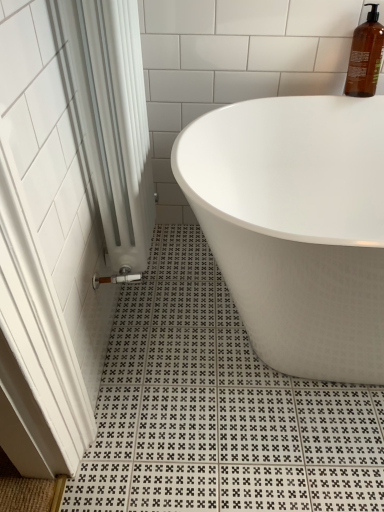
Question: From a real-world perspective, is white glossy bathtub at center under white fabric shower curtain at left?

Choices:
 (A) yes
 (B) no

Answer: (A)

Question: Considering the relative sizes of white glossy bathtub at center and white fabric shower curtain at left in the image provided, is white glossy bathtub at center smaller than white fabric shower curtain at left?

Choices:
 (A) no
 (B) yes

Answer: (A)

Question: Considering the relative sizes of white glossy bathtub at center and white fabric shower curtain at left in the image provided, is white glossy bathtub at center taller than white fabric shower curtain at left?

Choices:
 (A) no
 (B) yes

Answer: (A)

Question: Does white glossy bathtub at center turn towards white fabric shower curtain at left?

Choices:
 (A) no
 (B) yes

Answer: (A)

Question: Is white glossy bathtub at center closer to the viewer compared to white fabric shower curtain at left?

Choices:
 (A) no
 (B) yes

Answer: (A)

Question: Is translucent amber bottle at upper right situated inside white glossy bathtub at center or outside?

Choices:
 (A) outside
 (B) inside

Answer: (A)

Question: Considering the positions of point (369, 52) and point (241, 138), is point (369, 52) closer or farther from the camera than point (241, 138)?

Choices:
 (A) farther
 (B) closer

Answer: (B)

Question: Is translucent amber bottle at upper right wider or thinner than white glossy bathtub at center?

Choices:
 (A) wide
 (B) thin

Answer: (B)

Question: Based on their sizes in the image, would you say translucent amber bottle at upper right is bigger or smaller than white glossy bathtub at center?

Choices:
 (A) big
 (B) small

Answer: (B)

Question: Looking at their shapes, would you say white glossy bathtub at center is wider or thinner than translucent amber bottle at upper right?

Choices:
 (A) thin
 (B) wide

Answer: (B)

Question: In the image, is white glossy bathtub at center on the left side or the right side of translucent amber bottle at upper right?

Choices:
 (A) right
 (B) left

Answer: (B)

Question: Is point (321, 179) positioned closer to the camera than point (365, 69)?

Choices:
 (A) farther
 (B) closer

Answer: (A)

Question: From the image's perspective, is white glossy bathtub at center above or below translucent amber bottle at upper right?

Choices:
 (A) above
 (B) below

Answer: (B)

Question: Visually, is white fabric shower curtain at left positioned to the left or to the right of white glossy bathtub at center?

Choices:
 (A) right
 (B) left

Answer: (B)

Question: From the image's perspective, is white fabric shower curtain at left located above or below white glossy bathtub at center?

Choices:
 (A) below
 (B) above

Answer: (B)